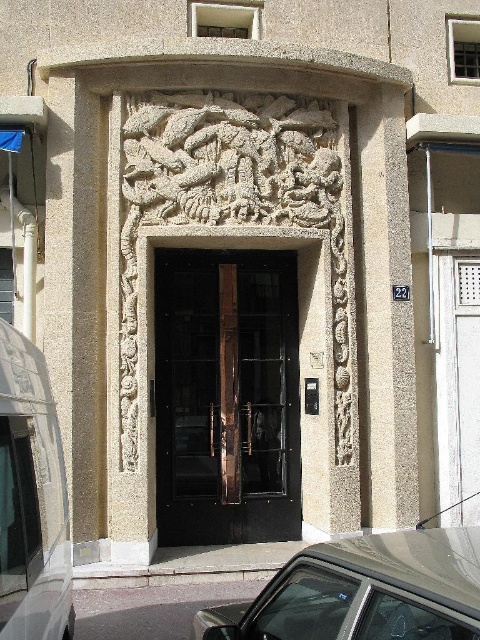
Which is more to the left, polished bronze door at center or metallic silver car at lower center?

From the viewer's perspective, polished bronze door at center appears more on the left side.

Who is taller, polished bronze door at center or metallic silver car at lower center?

Standing taller between the two is polished bronze door at center.

Locate an element on the screen. The width and height of the screenshot is (480, 640). polished bronze door at center is located at coordinates (227, 396).

Which is more to the left, metallic silver car at lower center or white matte van at left?

white matte van at left

Which of these two, metallic silver car at lower center or white matte van at left, stands taller?

white matte van at left

Does point (350, 577) come farther from viewer compared to point (25, 371)?

No, (350, 577) is closer to viewer.

Find the location of a particular element. The height and width of the screenshot is (640, 480). metallic silver car at lower center is located at coordinates (363, 592).

Who is shorter, polished bronze door at center or white matte van at left?

white matte van at left is shorter.

Can you confirm if polished bronze door at center is positioned to the right of white matte van at left?

Indeed, polished bronze door at center is positioned on the right side of white matte van at left.

Does point (294, 371) lie in front of point (31, 499)?

No, it is behind (31, 499).

This screenshot has width=480, height=640. I want to click on polished bronze door at center, so 227,396.